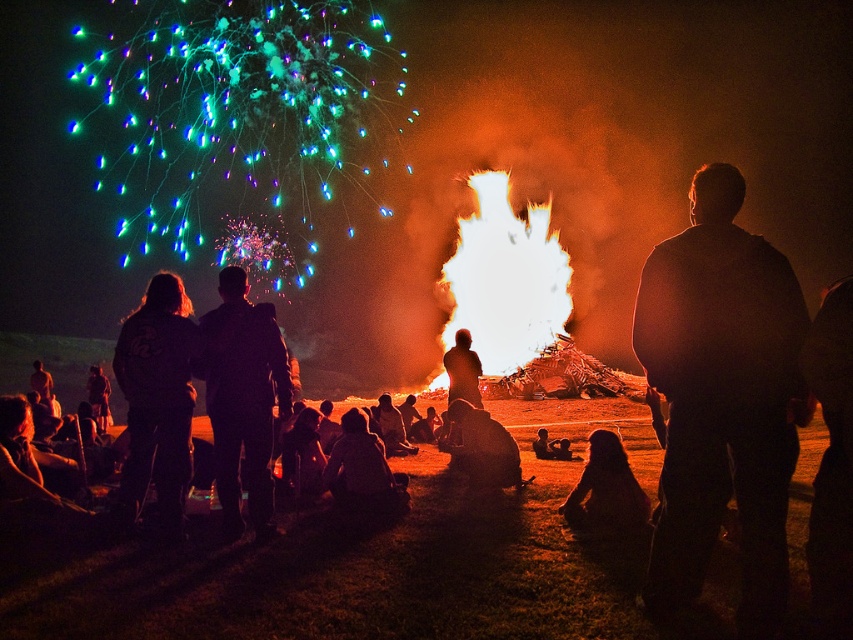
Question: Which point is farther to the camera?

Choices:
 (A) black matte jacket at center
 (B) black matte jacket at right

Answer: (A)

Question: Can you confirm if black matte jacket at center is smaller than silhouette fabric at lower center?

Choices:
 (A) yes
 (B) no

Answer: (B)

Question: Is black fabric jacket at left thinner than silhouette figure at center?

Choices:
 (A) yes
 (B) no

Answer: (B)

Question: Which object is the closest to the silhouette figure at center?

Choices:
 (A) silhouette fabric at center
 (B) black matte jacket at right
 (C) silhouette fabric at lower center

Answer: (A)

Question: From the image, what is the correct spatial relationship of black fabric jacket at left in relation to silhouette fabric at lower center?

Choices:
 (A) right
 (B) left

Answer: (B)

Question: Estimate the real-world distances between objects in this image. Which object is closer to the black matte jacket at right?

Choices:
 (A) black fabric jacket at left
 (B) silhouette fabric at center
 (C) silhouette fabric at lower center
 (D) black matte jacket at center

Answer: (C)